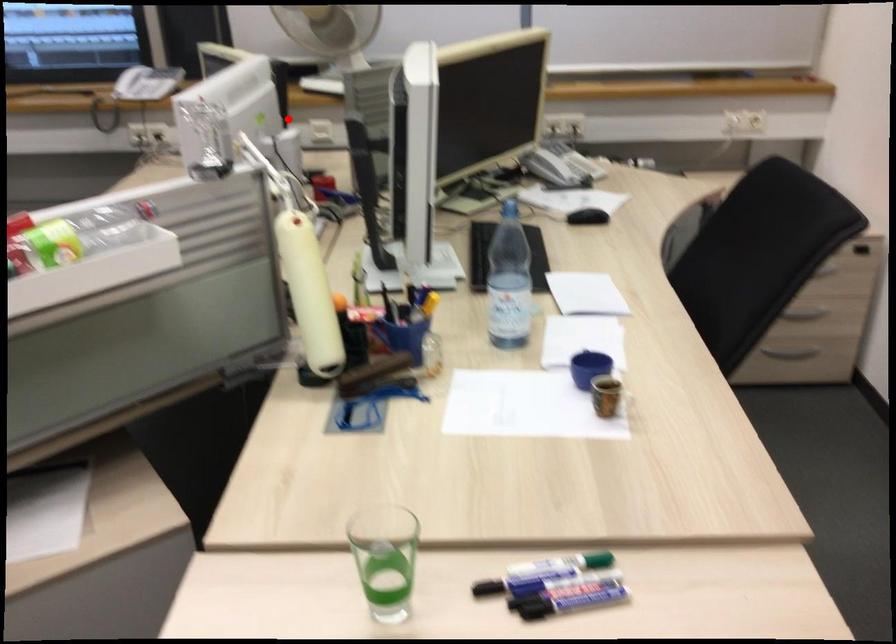
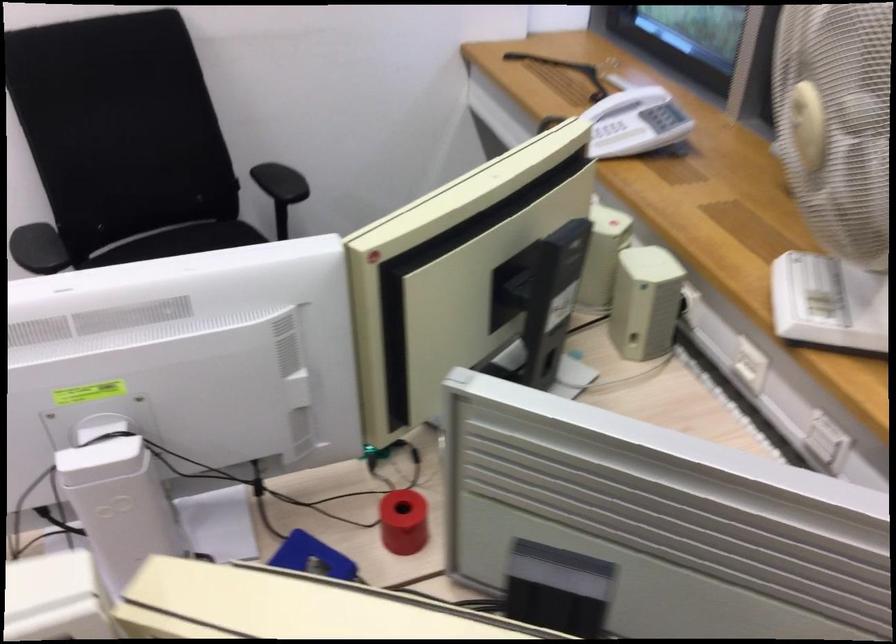
Question: I am providing you with two images of the same scene from different viewpoints. In image1, a red point is highlighted. Considering the same 3D point in image2, which of the following is correct?

Choices:
 (A) It is closer
 (B) It is farther

Answer: (A)